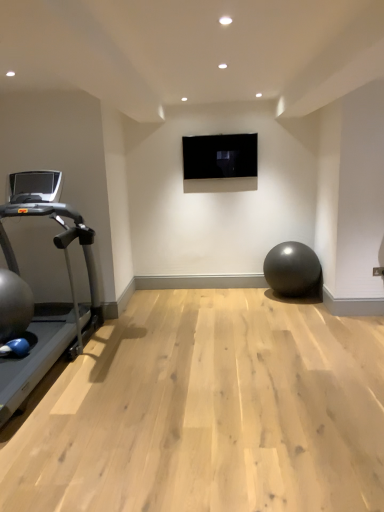
Question: Is silver metallic treadmill at left wider or thinner than metallic gray ball at center?

Choices:
 (A) thin
 (B) wide

Answer: (B)

Question: Would you say silver metallic treadmill at left is to the left or to the right of metallic gray ball at center in the picture?

Choices:
 (A) left
 (B) right

Answer: (A)

Question: Considering the positions of point (6, 281) and point (288, 256), is point (6, 281) closer or farther from the camera than point (288, 256)?

Choices:
 (A) closer
 (B) farther

Answer: (A)

Question: Considering their positions, is metallic gray ball at center located in front of or behind silver metallic treadmill at left?

Choices:
 (A) front
 (B) behind

Answer: (B)

Question: In terms of width, does metallic gray ball at center look wider or thinner when compared to silver metallic treadmill at left?

Choices:
 (A) wide
 (B) thin

Answer: (B)

Question: From the image's perspective, is metallic gray ball at center located above or below silver metallic treadmill at left?

Choices:
 (A) above
 (B) below

Answer: (B)

Question: Is metallic gray ball at center spatially inside silver metallic treadmill at left, or outside of it?

Choices:
 (A) inside
 (B) outside

Answer: (B)